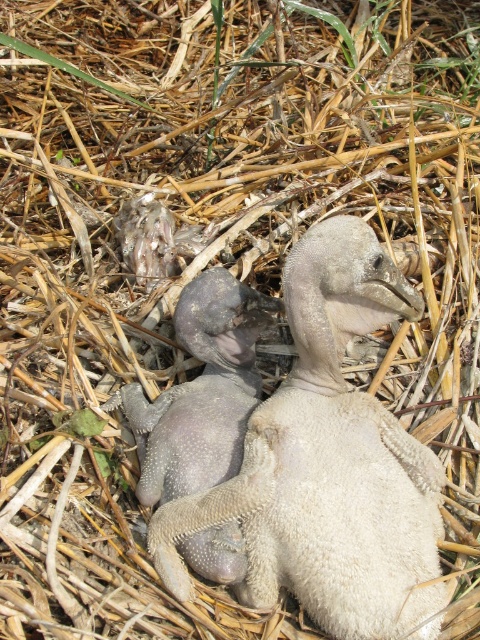
Question: Is gray downy duckling at center to the left of purple fuzzy duckling at center from the viewer's perspective?

Choices:
 (A) yes
 (B) no

Answer: (B)

Question: Among these points, which one is farthest from the camera?

Choices:
 (A) coord(411,288)
 (B) coord(254,372)

Answer: (B)

Question: Is gray downy duckling at center above purple fuzzy duckling at center?

Choices:
 (A) yes
 (B) no

Answer: (A)

Question: Can you confirm if gray downy duckling at center is positioned to the right of purple fuzzy duckling at center?

Choices:
 (A) yes
 (B) no

Answer: (A)

Question: Which point is closer to the camera?

Choices:
 (A) purple fuzzy duckling at center
 (B) gray downy duckling at center

Answer: (B)

Question: Which point appears farthest from the camera in this image?

Choices:
 (A) (199, 464)
 (B) (359, 445)

Answer: (A)